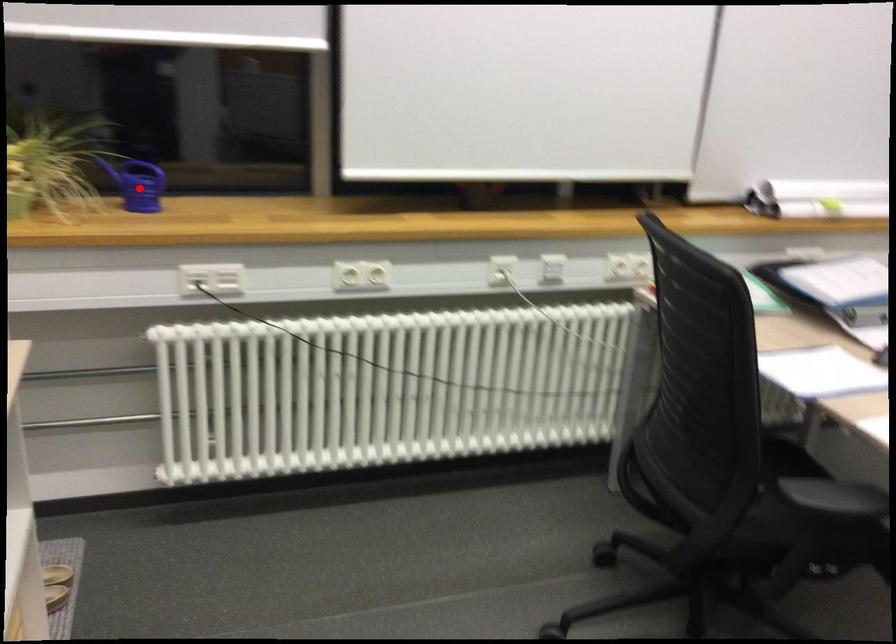
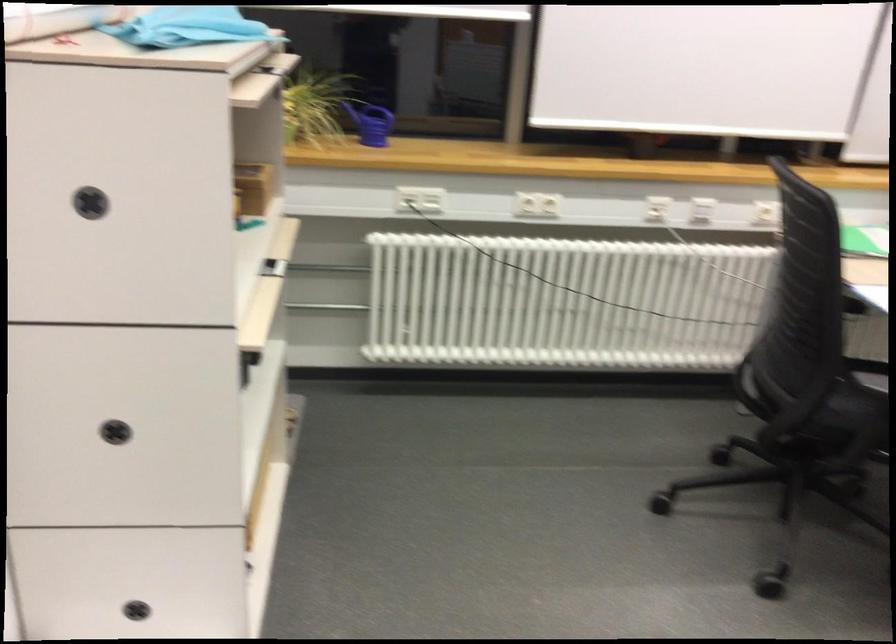
Question: I am providing you with two images of the same scene from different viewpoints. Given a red point in image1, look at the same physical point in image2. Is it:

Choices:
 (A) Closer to the viewpoint
 (B) Farther from the viewpoint

Answer: (B)